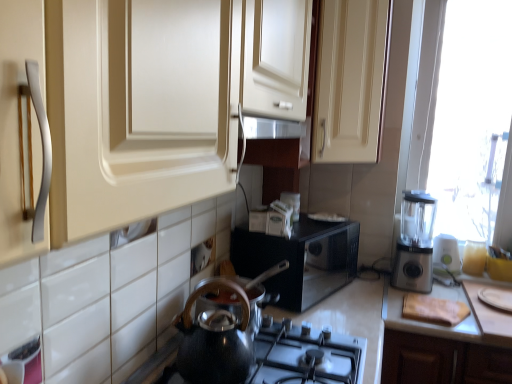
Question: From their relative heights in the image, would you say white plastic blender at right, the second appliance from the right, is taller or shorter than white plastic plate at lower right, which appears as the 3th appliance when viewed from the left?

Choices:
 (A) short
 (B) tall

Answer: (B)

Question: Is point (449, 241) positioned closer to the camera than point (505, 301)?

Choices:
 (A) farther
 (B) closer

Answer: (A)

Question: Based on their relative distances, which object is farther from the black glossy kettle at lower center?

Choices:
 (A) matte cream cabinet at upper center
 (B) white matte cutting board at right
 (C) black glossy microwave at center, the 3th appliance when ordered from right to left
 (D) white plastic plate at lower right, acting as the 1th appliance starting from the right
 (E) shiny black kettle at lower center

Answer: (D)

Question: Which object is positioned farthest from the shiny black kettle at lower center?

Choices:
 (A) matte cream cabinet at upper center
 (B) black glossy microwave at center, the 1th appliance from the left
 (C) silver metallic blender at right
 (D) white plastic blender at right, which is counted as the second appliance, starting from the left
 (E) black glossy kettle at lower center

Answer: (D)